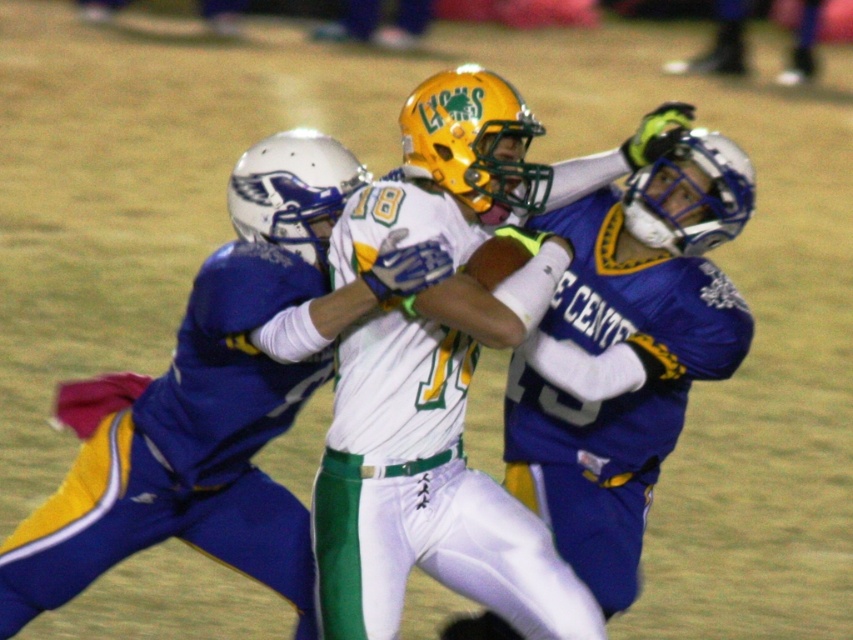
Is white matte helmet at center to the left of blue jersey at center from the viewer's perspective?

Indeed, white matte helmet at center is positioned on the left side of blue jersey at center.

Does white matte helmet at center have a greater width compared to blue jersey at center?

Indeed, white matte helmet at center has a greater width compared to blue jersey at center.

Does point (338, 211) come behind point (700, 352)?

That is False.

Locate an element on the screen. white matte helmet at center is located at coordinates (219, 397).